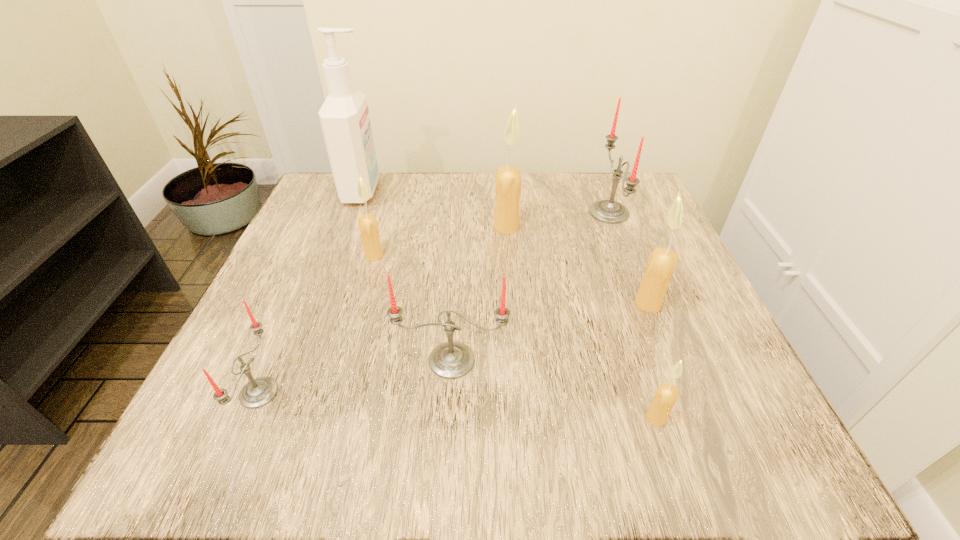
You are a GUI agent. You are given a task and a screenshot of the screen. Output one action in this format:
    pyautogui.click(x=<x>, y=<y>)
    Task: Click on the tallest object
    This screenshot has width=960, height=540.
    Given the screenshot: What is the action you would take?
    pyautogui.click(x=344, y=116)

What are the coordinates of `the seventh shortest object` in the screenshot? It's located at (508, 178).

At what (x,y) coordinates should I click in order to perform the action: click on the tallest candle. Please return your answer as a coordinate pair (x, y). Looking at the image, I should click on (508, 178).

The width and height of the screenshot is (960, 540). Find the location of `the farthest red candle`. the farthest red candle is located at coordinates (607, 211).

Find the location of a particular element. The height and width of the screenshot is (540, 960). the rightmost red candle is located at coordinates (607, 211).

At what (x,y) coordinates should I click in order to perform the action: click on the rightmost cream candle. Please return your answer as a coordinate pair (x, y). This screenshot has height=540, width=960. Looking at the image, I should click on (662, 262).

Locate an element on the screen. The width and height of the screenshot is (960, 540). the second nearest cream candle is located at coordinates (662, 262).

You are a GUI agent. You are given a task and a screenshot of the screen. Output one action in this format:
    pyautogui.click(x=<x>, y=<y>)
    Task: Click on the third farthest candle
    
    Given the screenshot: What is the action you would take?
    pyautogui.click(x=368, y=226)

Find the location of `the sixth object from right to left`. the sixth object from right to left is located at coordinates (368, 226).

In order to click on the second red candle from right to left in this screenshot , I will do coord(451,360).